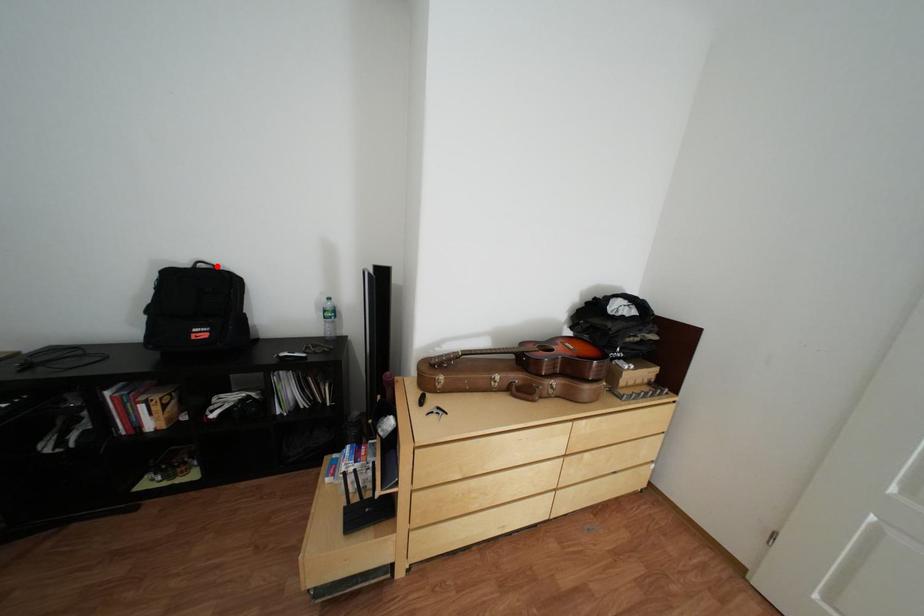
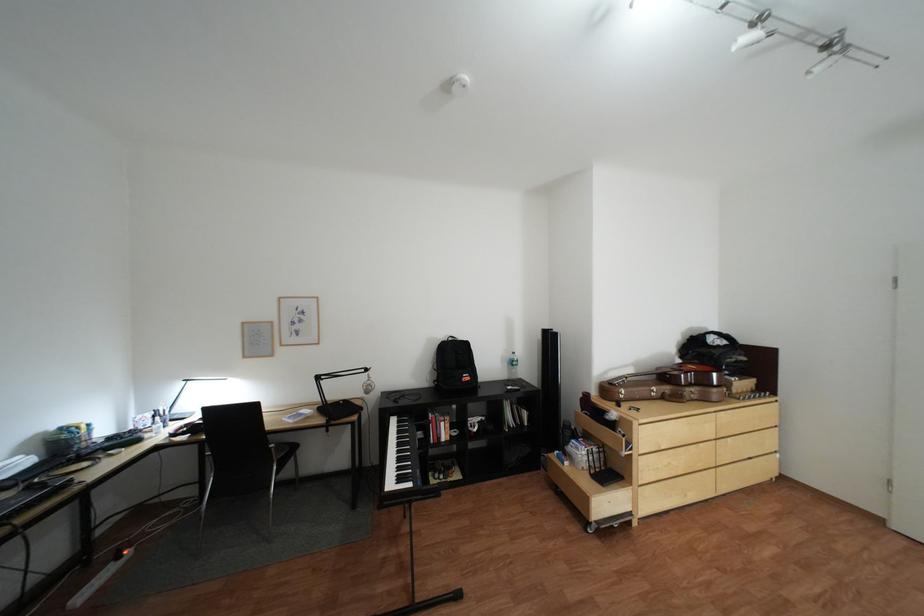
The point at the highlighted location is marked in the first image. Where is the corresponding point in the second image?

(466, 339)